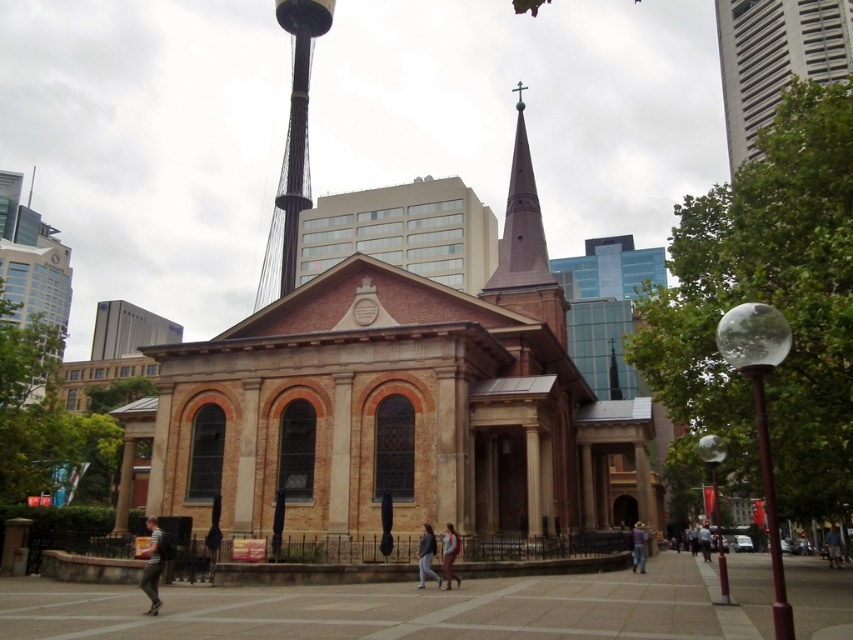
Can you confirm if dark gray fabric pants at lower left is smaller than dark blue jeans at center?

Correct, dark gray fabric pants at lower left occupies less space than dark blue jeans at center.

The image size is (853, 640). What do you see at coordinates (152, 564) in the screenshot?
I see `dark gray fabric pants at lower left` at bounding box center [152, 564].

You are a GUI agent. You are given a task and a screenshot of the screen. Output one action in this format:
    pyautogui.click(x=<x>, y=<y>)
    Task: Click on the dark gray fabric pants at lower left
    
    Given the screenshot: What is the action you would take?
    pyautogui.click(x=152, y=564)

Is point (721, 552) farther from viewer compared to point (444, 545)?

No, it is not.

Can you confirm if transparent glass lamp post at lower right is positioned below light brown leather jacket at center?

Yes.

Is point (712, 481) farther from viewer compared to point (450, 557)?

Yes.

The height and width of the screenshot is (640, 853). In order to click on transparent glass lamp post at lower right in this screenshot , I will do (x=715, y=499).

What do you see at coordinates (152, 564) in the screenshot? Image resolution: width=853 pixels, height=640 pixels. I see `dark gray fabric pants at lower left` at bounding box center [152, 564].

Can you confirm if dark gray fabric pants at lower left is positioned below light brown leather jacket at center?

Yes.

Find the location of a particular element. This screenshot has width=853, height=640. dark gray fabric pants at lower left is located at coordinates (152, 564).